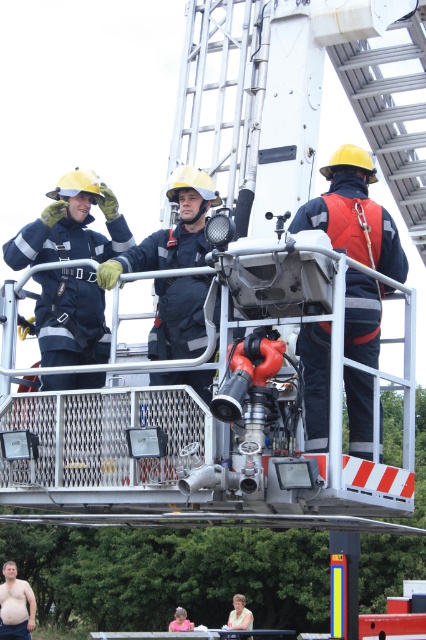
You are an emergency responder on a fire truck platform. You notice a yellow hard hat at upper center and a pink fabric shirt at lower center. Which object is located higher from the ground?

The yellow hard hat at upper center is positioned over the pink fabric shirt at lower center, so it is higher from the ground.

You are a firefighter on a raised platform of a fire truck. You need to move from your current position to the point marked as point [22,611] and then to point [184,616]. Which point will you reach first?

You will reach point [22,611] first because it is in front of point [184,616].

You are an emergency responder on a fire truck platform. You need to retrieve a tool from the yellow hard hat at upper center, but there is a skinny man at lower left in your way. Can you reach the hat without moving the man?

The skinny man at lower left is located above the yellow hard hat at upper center, so the hat is below him. Since the man is above the hat, you can reach down to get the hat without needing to move him.